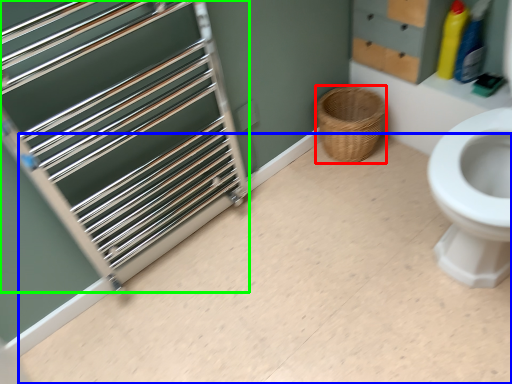
Question: Considering the real-world distances, which object is closest to basket (highlighted by a red box)? plain (highlighted by a blue box) or cage (highlighted by a green box).

Choices:
 (A) plain
 (B) cage

Answer: (A)